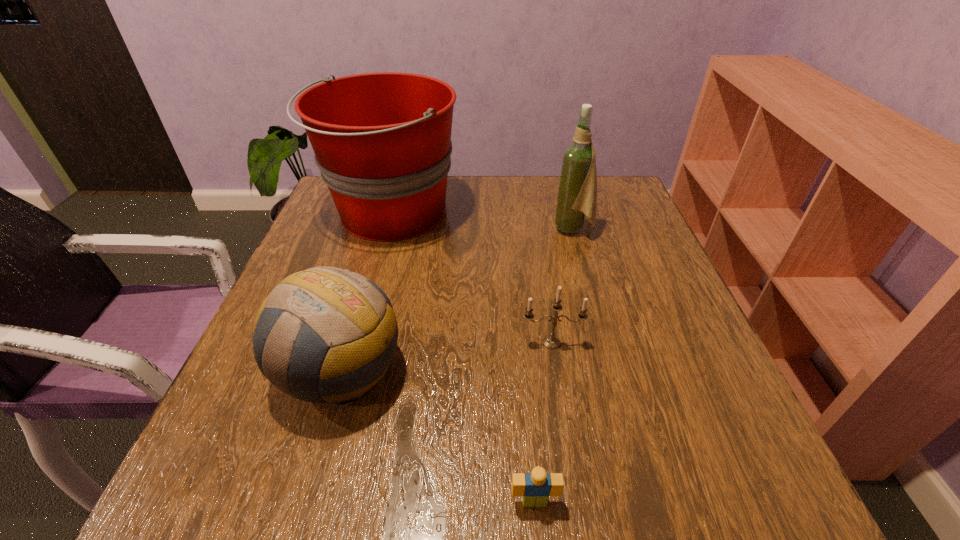
Where is `vacant region located on the back of the volleyball`? vacant region located on the back of the volleyball is located at coordinates click(383, 225).

Find the location of a particular element. vacant area located 0.080m on the front of the candle is located at coordinates (559, 387).

Locate an element on the screen. The image size is (960, 540). bucket that is at the far edge is located at coordinates [x=382, y=141].

Identify the location of wine bottle that is at the far edge. This screenshot has width=960, height=540. (577, 194).

The image size is (960, 540). I want to click on object that is at the near edge, so click(x=535, y=488).

Identify the location of bucket that is at the left edge. This screenshot has height=540, width=960. coord(382,141).

Where is `volleyball located at the left edge`? volleyball located at the left edge is located at coordinates pyautogui.click(x=327, y=335).

Find the location of a particular element. The height and width of the screenshot is (540, 960). object located at the right edge is located at coordinates [577, 194].

Locate an element on the screen. object at the far left corner is located at coordinates (382, 141).

The height and width of the screenshot is (540, 960). Identify the location of object that is positioned at the far right corner. (577, 194).